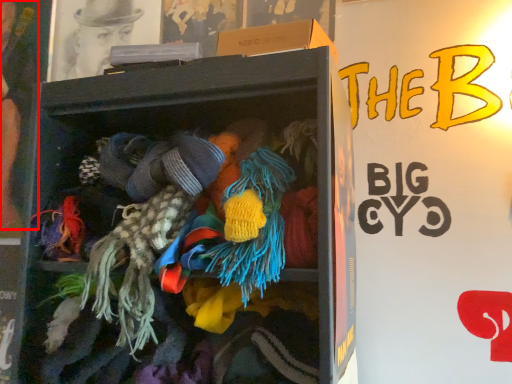
Question: From the image's perspective, where is person (annotated by the red box) located in relation to shelf in the image?

Choices:
 (A) above
 (B) below

Answer: (A)